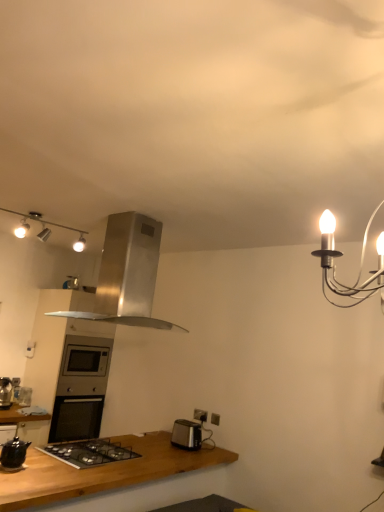
Locate an element on the screen. The image size is (384, 512). vacant area on top of brown wooden countertop at lower left (from a real-world perspective) is located at coordinates (114, 454).